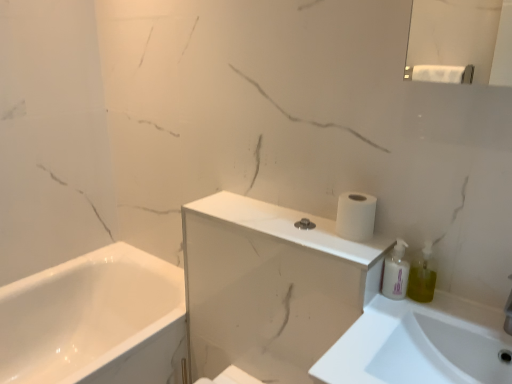
You are a GUI agent. You are given a task and a screenshot of the screen. Output one action in this format:
    pyautogui.click(x=<x>, y=<y>)
    Task: Click on the vacant area that lies in front of white glossy pump bottle at right
    This screenshot has width=512, height=384.
    Given the screenshot: What is the action you would take?
    click(x=396, y=319)